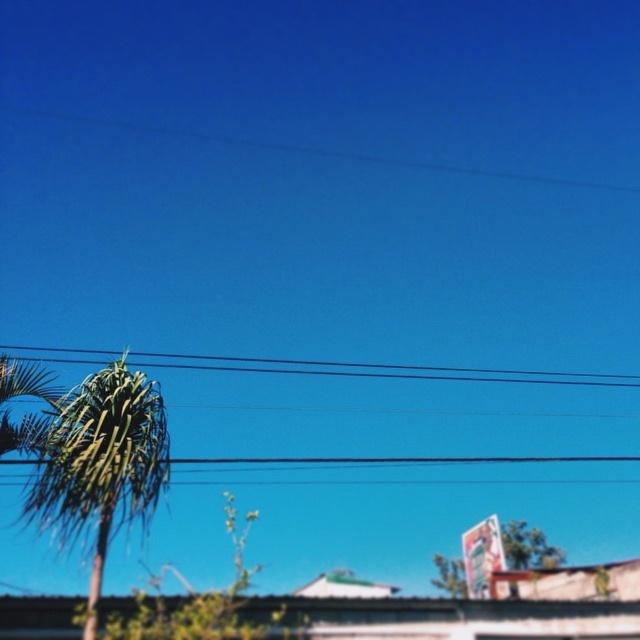
Between green leafy palm tree at left and black wire at upper center, which one is positioned higher?

black wire at upper center

Identify the location of green leafy palm tree at left. This screenshot has height=640, width=640. (100, 464).

Who is more forward, (93, 588) or (465, 380)?

Point (93, 588) is more forward.

This screenshot has height=640, width=640. What are the coordinates of `green leafy palm tree at left` in the screenshot? It's located at (100, 464).

Is green leafy palm tree at left shorter than green leafy tree at lower center?

No.

This screenshot has width=640, height=640. Describe the element at coordinates (100, 464) in the screenshot. I see `green leafy palm tree at left` at that location.

Does point (132, 470) come farther from viewer compared to point (465, 584)?

No.

Locate an element on the screen. green leafy palm tree at left is located at coordinates point(100,464).

Can you confirm if black wire at upper center is positioned to the right of green leafy tree at lower center?

Incorrect, black wire at upper center is not on the right side of green leafy tree at lower center.

Which is more to the right, black wire at upper center or green leafy tree at lower center?

green leafy tree at lower center is more to the right.

Locate an element on the screen. The width and height of the screenshot is (640, 640). black wire at upper center is located at coordinates (378, 369).

Where is `black wire at upper center`? This screenshot has width=640, height=640. black wire at upper center is located at coordinates (378, 369).